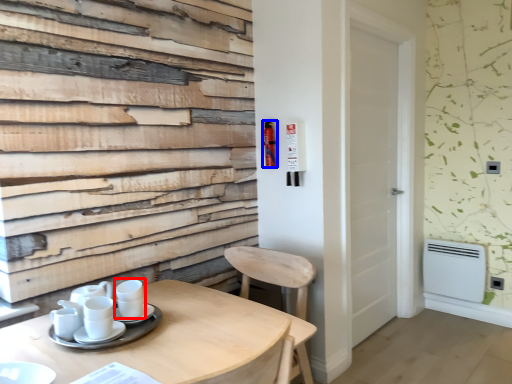
Question: Which of the following is the farthest to the observer, coffee cup (highlighted by a red box) or extinguisher (highlighted by a blue box)?

Choices:
 (A) coffee cup
 (B) extinguisher

Answer: (B)